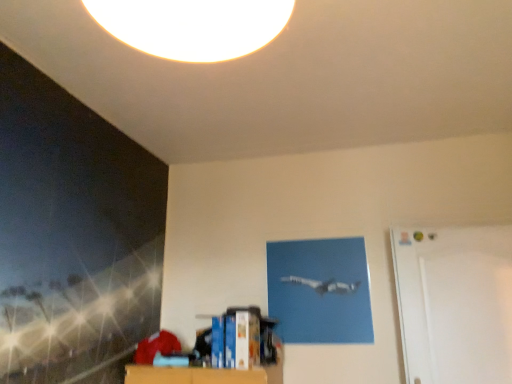
The width and height of the screenshot is (512, 384). Describe the element at coordinates (454, 303) in the screenshot. I see `white matte door at right` at that location.

Identify the location of white matte door at right. The width and height of the screenshot is (512, 384). (454, 303).

I want to click on white matte door at right, so click(454, 303).